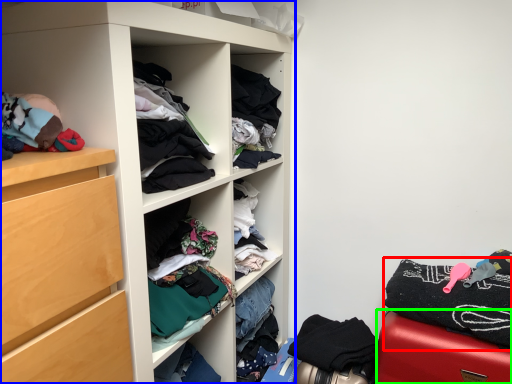
Question: Which object is the closest to the clothing (highlighted by a red box)? Choose among these: cupboard (highlighted by a blue box) or furniture (highlighted by a green box).

Choices:
 (A) cupboard
 (B) furniture

Answer: (B)